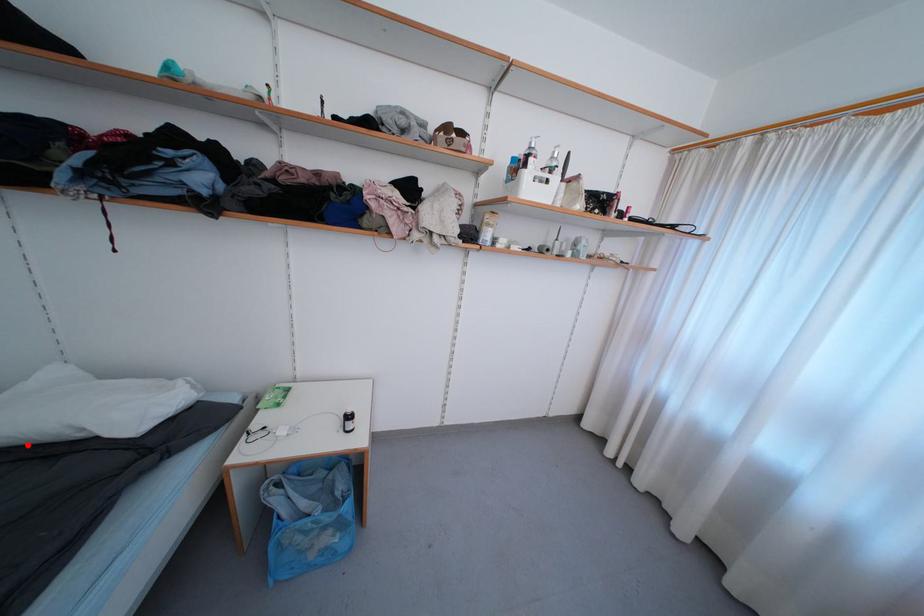
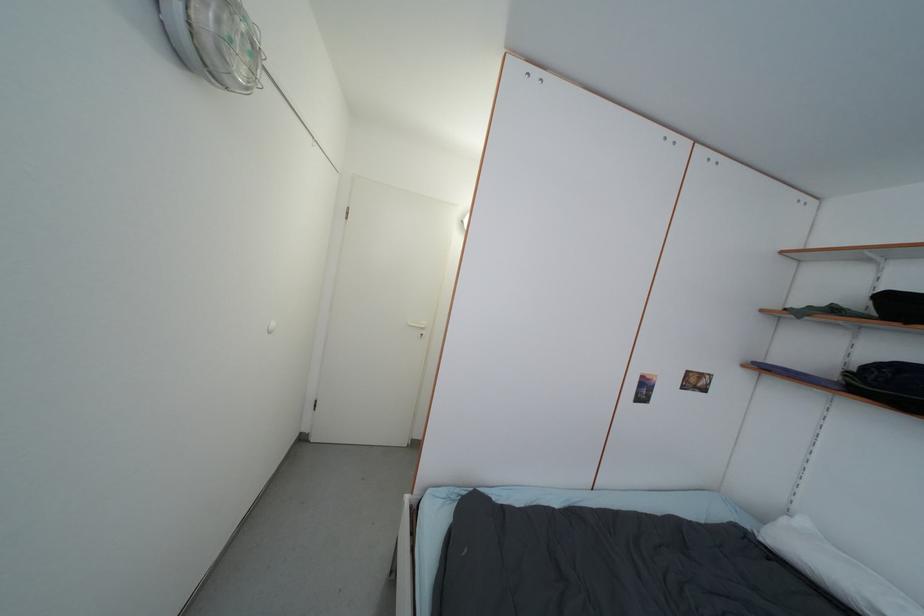
Where in the second image is the point corresponding to the highlighted location from the first image?

(812, 576)